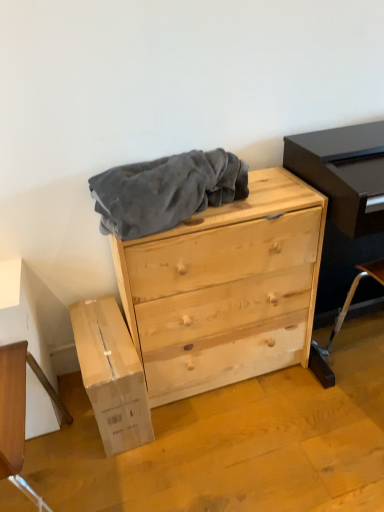
Where is `free space to the left of white cardboard box at lower left`? The height and width of the screenshot is (512, 384). free space to the left of white cardboard box at lower left is located at coordinates (62, 417).